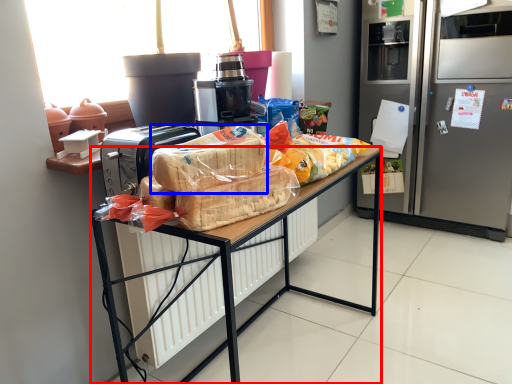
Question: Which object appears closest to the camera in this image, desk (highlighted by a red box) or snack (highlighted by a blue box)?

Choices:
 (A) desk
 (B) snack

Answer: (B)